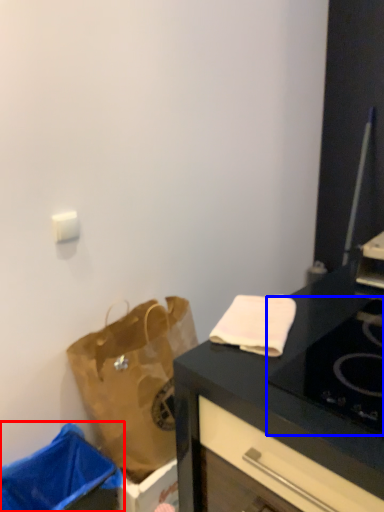
Question: Which object is closer to the camera taking this photo, trash bin/can (highlighted by a red box) or gas stove (highlighted by a blue box)?

Choices:
 (A) trash bin/can
 (B) gas stove

Answer: (B)